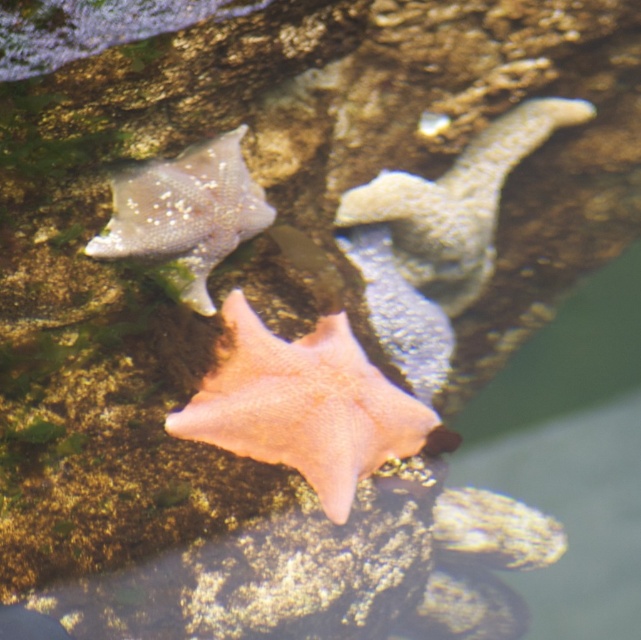
Who is taller, pink matte starfish at center or smooth gray starfish at upper left?

Standing taller between the two is pink matte starfish at center.

Is pink matte starfish at center above smooth gray starfish at upper left?

No, pink matte starfish at center is not above smooth gray starfish at upper left.

The image size is (641, 640). I want to click on pink matte starfish at center, so click(x=304, y=404).

In the scene shown: Does pink matte starfish at center appear under smooth gray starfish at center?

Correct, pink matte starfish at center is located below smooth gray starfish at center.

Consider the image. Can you confirm if pink matte starfish at center is positioned above smooth gray starfish at center?

Incorrect, pink matte starfish at center is not positioned above smooth gray starfish at center.

Is point (254, 445) less distant than point (488, 253)?

Yes, it is in front of point (488, 253).

Where is `pink matte starfish at center`? The width and height of the screenshot is (641, 640). pink matte starfish at center is located at coordinates (304, 404).

From the picture: Can you confirm if smooth gray starfish at center is thinner than smooth gray starfish at upper left?

No.

Does point (487, 214) come closer to viewer compared to point (160, 192)?

No, (487, 214) is behind (160, 192).

The width and height of the screenshot is (641, 640). I want to click on smooth gray starfish at center, so click(x=456, y=204).